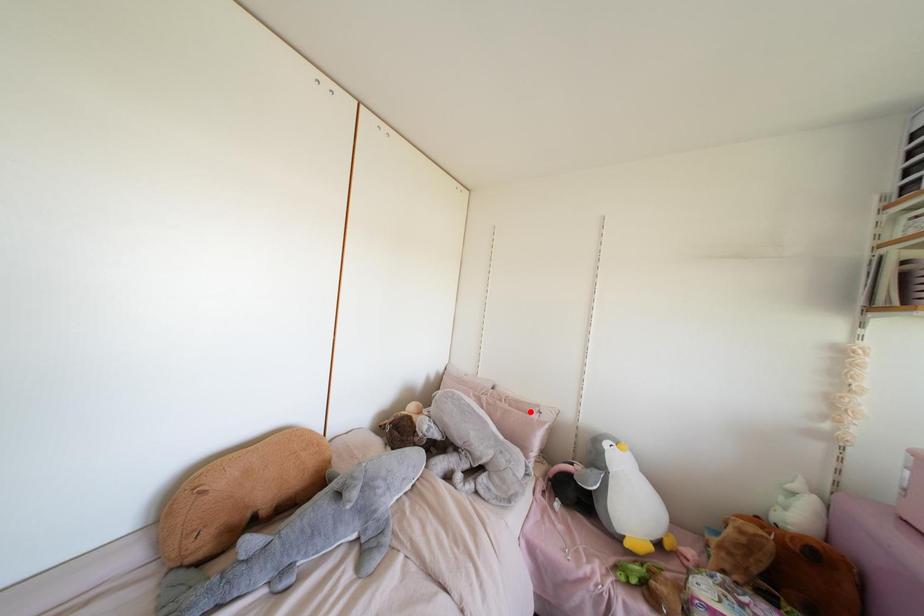
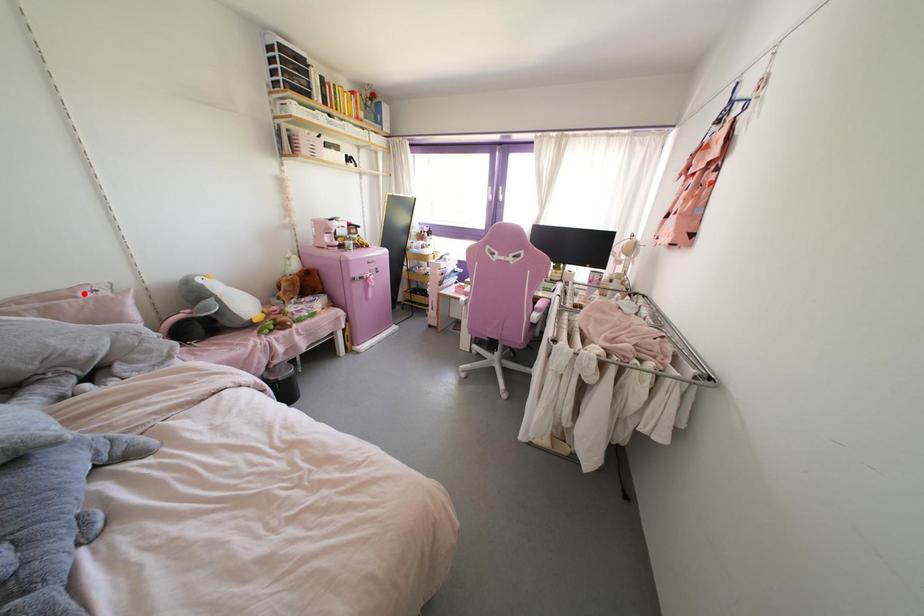
I am providing you with two images of the same scene from different viewpoints. A red point is marked on the first image and another point is marked on the second image. Do the highlighted points in image1 and image2 indicate the same real-world spot?

Yes